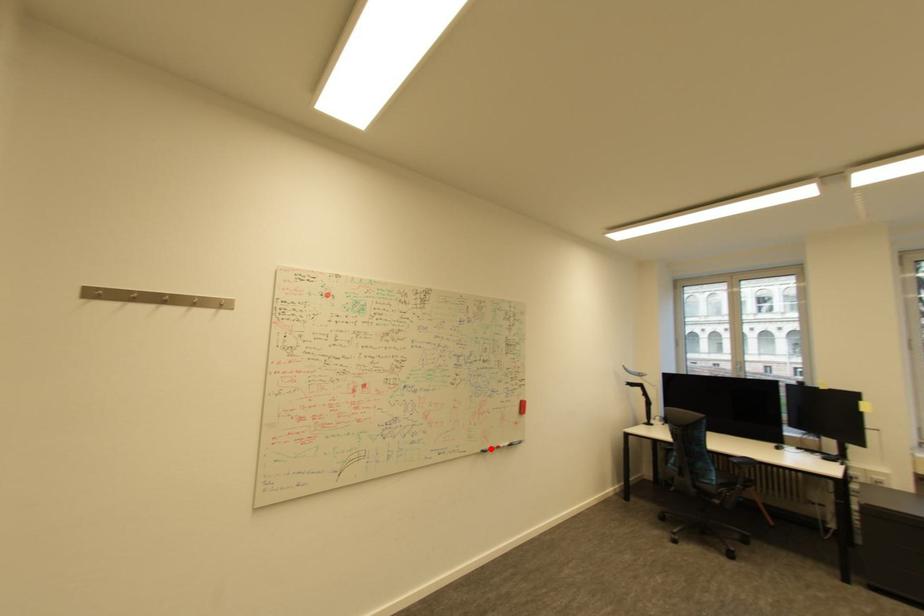
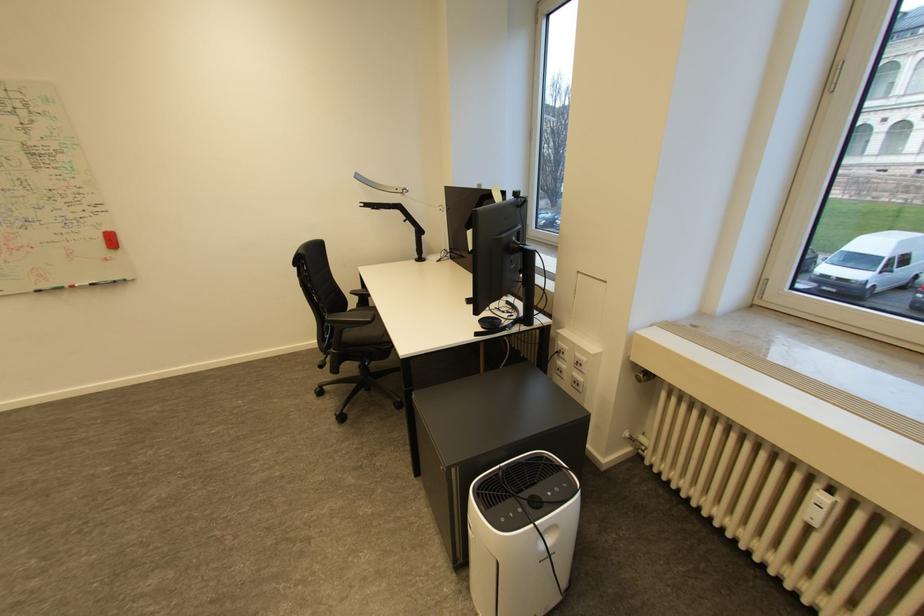
Find the pixel in the second image that matches the highlighted location in the first image.

(47, 288)